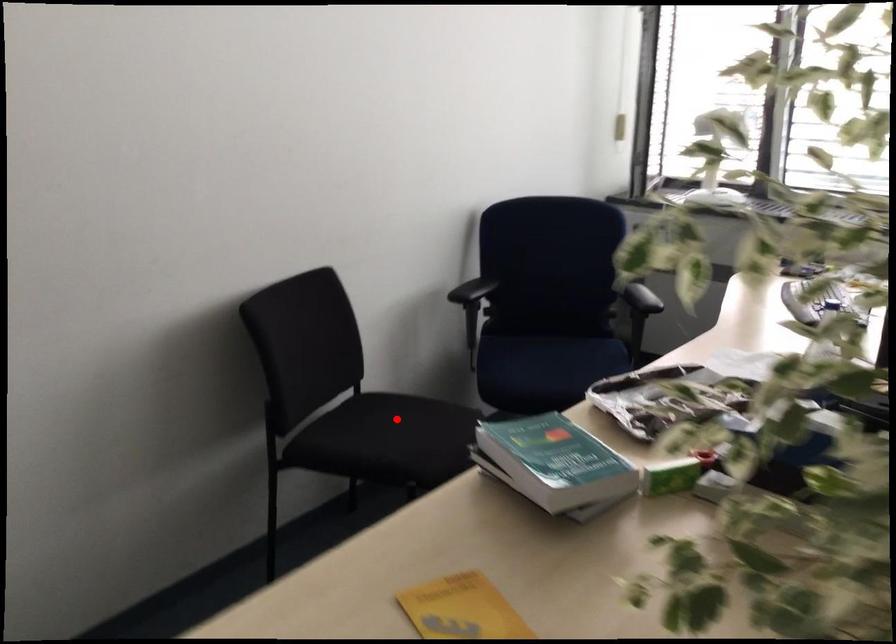
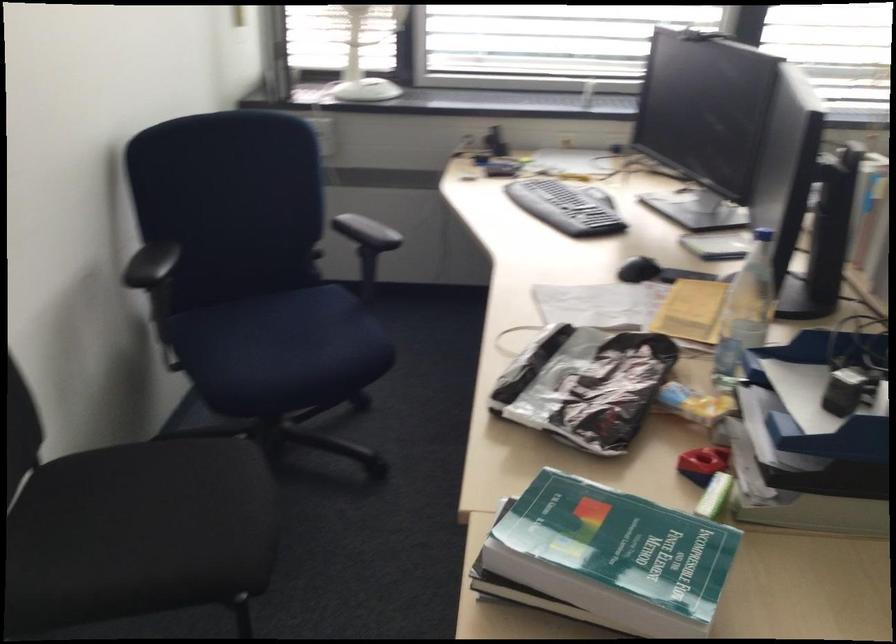
Question: I am providing you with two images of the same scene from different viewpoints. A red point is marked on the first image. Can you still see the location of the red point in image 2?

Choices:
 (A) Yes
 (B) No

Answer: (A)